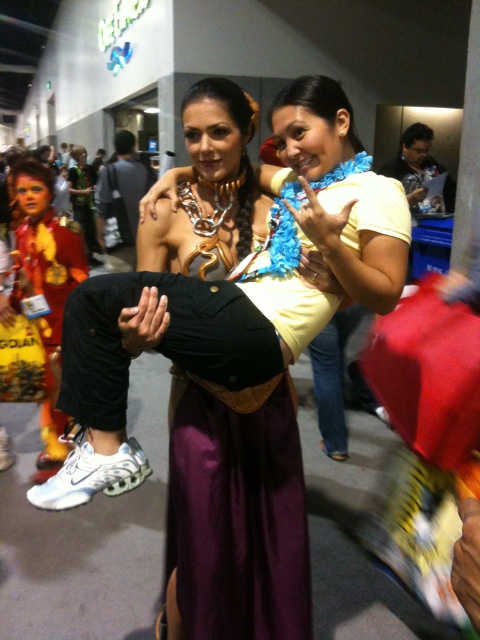
You are a photographer at the event and want to capture a photo where both the shiny metallic costume at left and the matte black shirt at upper right are visible. Based on their positions, which object is closer to the camera?

The shiny metallic costume at left is closer to the camera because it is in front of the matte black shirt at upper right.

You are a photographer at the event and want to capture a photo that includes both the shiny metallic costume at left and the matte black shirt at upper right. Based on their positions, which object should you position closer to the left side of the frame?

The shiny metallic costume at left should be positioned closer to the left side of the frame since it is located to the left of the matte black shirt at upper right.